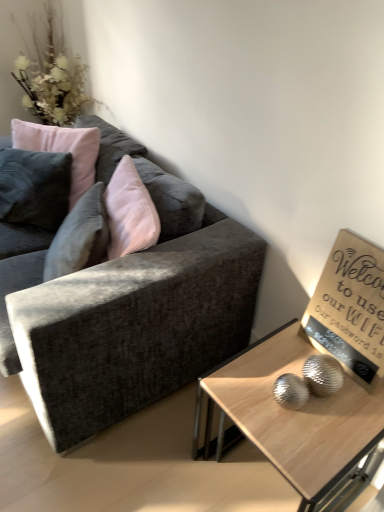
Measure the distance between point (x=70, y=200) and camera.

1.98 meters.

I want to click on wooden sign at upper right, so click(x=350, y=309).

Based on the photo, would you say wooden glossy coffee table at lower right is to the left or to the right of white fluffy flowers at upper left in the picture?

Based on their positions, wooden glossy coffee table at lower right is located to the right of white fluffy flowers at upper left.

Which object is further away from the camera, wooden glossy coffee table at lower right or white fluffy flowers at upper left?

white fluffy flowers at upper left is more distant.

Can you tell me how much wooden glossy coffee table at lower right and white fluffy flowers at upper left differ in facing direction?

The facing directions of wooden glossy coffee table at lower right and white fluffy flowers at upper left are 2.86 degrees apart.

Does wooden glossy coffee table at lower right have a lesser height compared to white fluffy flowers at upper left?

Yes, wooden glossy coffee table at lower right is shorter than white fluffy flowers at upper left.

Is wooden glossy coffee table at lower right positioned with its back to velvet dark gray couch at left?

That's not correct — wooden glossy coffee table at lower right is not looking away from velvet dark gray couch at left.

From the image's perspective, is wooden glossy coffee table at lower right on top of velvet dark gray couch at left?

No, from the image's perspective, wooden glossy coffee table at lower right is not above velvet dark gray couch at left.

I want to click on studio couch positioned vertically above the wooden glossy coffee table at lower right (from a real-world perspective), so click(127, 308).

What's the angular difference between wooden glossy coffee table at lower right and velvet dark gray couch at left's facing directions?

The angle between the facing direction of wooden glossy coffee table at lower right and the facing direction of velvet dark gray couch at left is 2.33 degrees.

Considering the sizes of objects wooden sign at upper right and velvet dark gray couch at left in the image provided, who is shorter, wooden sign at upper right or velvet dark gray couch at left?

Standing shorter between the two is wooden sign at upper right.

Does wooden sign at upper right come in front of velvet dark gray couch at left?

No, it is behind velvet dark gray couch at left.

Is wooden sign at upper right positioned far away from velvet dark gray couch at left?

Actually, wooden sign at upper right and velvet dark gray couch at left are a little close together.

From a real-world perspective, who is located higher, wooden sign at upper right or velvet dark gray couch at left?

From a 3D spatial view, wooden sign at upper right is above.

Considering the sizes of objects white fluffy flowers at upper left and velvet dark gray couch at left in the image provided, who is smaller, white fluffy flowers at upper left or velvet dark gray couch at left?

white fluffy flowers at upper left is smaller.

From a real-world perspective, is white fluffy flowers at upper left physically above velvet dark gray couch at left?

Yes.

Would you say white fluffy flowers at upper left contains velvet dark gray couch at left?

No, velvet dark gray couch at left is not a part of white fluffy flowers at upper left.

Between white fluffy flowers at upper left and velvet dark gray couch at left, which one appears on the right side from the viewer's perspective?

From the viewer's perspective, velvet dark gray couch at left appears more on the right side.

Which of these two, wooden glossy coffee table at lower right or velvet pink pillow at upper left, stands shorter?

Standing shorter between the two is wooden glossy coffee table at lower right.

Is velvet pink pillow at upper left at the back of wooden glossy coffee table at lower right?

No.

Identify the location of coffee table below the velvet pink pillow at upper left (from the image's perspective). (295, 421).

Would you say wooden glossy coffee table at lower right is outside velvet pink pillow at upper left?

Yes, wooden glossy coffee table at lower right is outside of velvet pink pillow at upper left.

Is wooden sign at upper right to the left of velvet pink pillow at upper left from the viewer's perspective?

No.

Is wooden sign at upper right positioned in front of velvet pink pillow at upper left?

Yes, it is in front of velvet pink pillow at upper left.

Does wooden sign at upper right have a smaller size compared to velvet pink pillow at upper left?

Correct, wooden sign at upper right occupies less space than velvet pink pillow at upper left.

Is wooden sign at upper right touching velvet pink pillow at upper left?

No, wooden sign at upper right is not next to velvet pink pillow at upper left.

From the image's perspective, does velvet dark gray couch at left appear higher than wooden glossy coffee table at lower right?

Yes, from the image's perspective, velvet dark gray couch at left is on top of wooden glossy coffee table at lower right.

Who is more distant, velvet dark gray couch at left or wooden glossy coffee table at lower right?

velvet dark gray couch at left is further from the camera.

From a real-world perspective, is velvet dark gray couch at left physically below wooden glossy coffee table at lower right?

Incorrect, from a real-world perspective, velvet dark gray couch at left is higher than wooden glossy coffee table at lower right.

Is velvet dark gray couch at left facing towards wooden glossy coffee table at lower right?

No, velvet dark gray couch at left is not facing towards wooden glossy coffee table at lower right.

Identify the location of flower lying above the wooden glossy coffee table at lower right (from the image's perspective). Image resolution: width=384 pixels, height=512 pixels. (51, 74).

Find the location of `studio couch above the wooden glossy coffee table at lower right (from a real-world perspective)`. studio couch above the wooden glossy coffee table at lower right (from a real-world perspective) is located at coordinates (127, 308).

From the image, which object appears to be farther from wooden sign at upper right, velvet pink pillow at upper left or velvet dark gray couch at left?

velvet pink pillow at upper left.

Which object lies nearer to the anchor point white fluffy flowers at upper left, velvet pink pillow at upper left or wooden glossy coffee table at lower right?

Based on the image, velvet pink pillow at upper left appears to be nearer to white fluffy flowers at upper left.

From the image, which object appears to be farther from velvet dark gray couch at left, wooden glossy coffee table at lower right or velvet pink pillow at upper left?

velvet pink pillow at upper left is positioned further to the anchor velvet dark gray couch at left.

Looking at the image, which one is located further to velvet pink pillow at upper left, white fluffy flowers at upper left or wooden sign at upper right?

wooden sign at upper right lies further to velvet pink pillow at upper left than the other object.

Estimate the real-world distances between objects in this image. Which object is closer to wooden glossy coffee table at lower right, white fluffy flowers at upper left or velvet pink pillow at upper left?

velvet pink pillow at upper left is positioned closer to the anchor wooden glossy coffee table at lower right.

When comparing their distances from white fluffy flowers at upper left, does wooden glossy coffee table at lower right or velvet dark gray couch at left seem closer?

velvet dark gray couch at left is positioned closer to the anchor white fluffy flowers at upper left.

When comparing their distances from velvet dark gray couch at left, does white fluffy flowers at upper left or wooden glossy coffee table at lower right seem closer?

Among the two, wooden glossy coffee table at lower right is located nearer to velvet dark gray couch at left.

Considering their positions, is velvet pink pillow at upper left positioned further to wooden sign at upper right than white fluffy flowers at upper left?

The object further to wooden sign at upper right is white fluffy flowers at upper left.

Image resolution: width=384 pixels, height=512 pixels. I want to click on coffee table between velvet dark gray couch at left and wooden sign at upper right from left to right, so click(295, 421).

This screenshot has width=384, height=512. I want to click on studio couch between white fluffy flowers at upper left and wooden glossy coffee table at lower right from top to bottom, so click(127, 308).

The width and height of the screenshot is (384, 512). Identify the location of pillow between white fluffy flowers at upper left and wooden glossy coffee table at lower right in the up-down direction. (62, 149).

Locate an element on the screen. The width and height of the screenshot is (384, 512). studio couch between white fluffy flowers at upper left and wooden sign at upper right is located at coordinates 127,308.